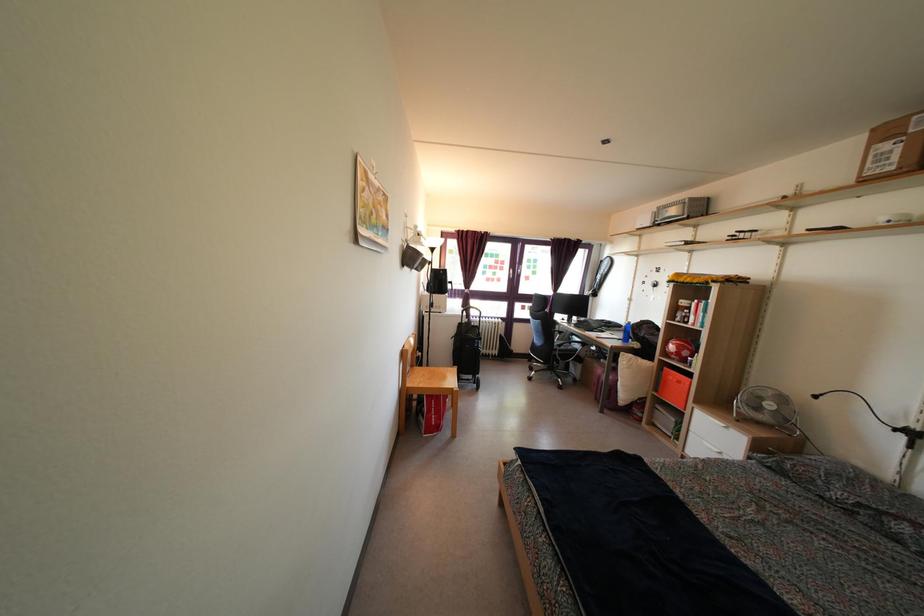
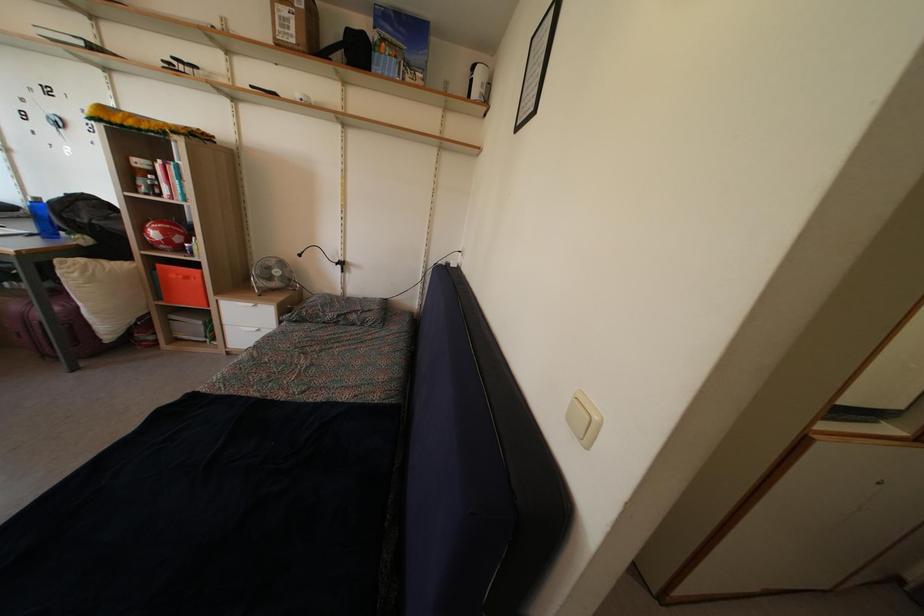
Where in the second image is the point corresponding to the point at 682,391 from the first image?

(189, 286)